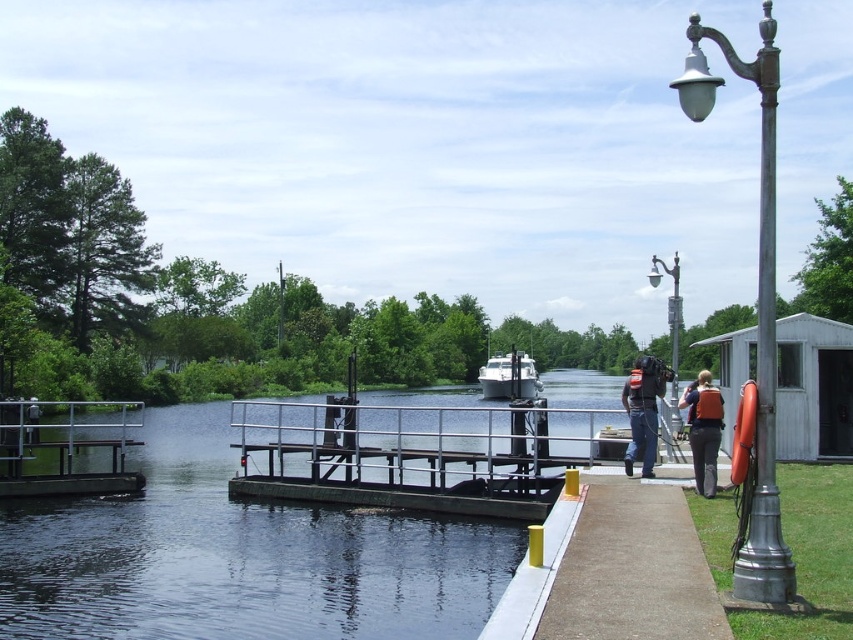
Looking at this image, does bronze metallic lamp post at right have a larger size compared to orange life vest at right?

Yes.

Between point (769, 374) and point (712, 422), which one is positioned in front?

Point (769, 374) is in front.

I want to click on bronze metallic lamp post at right, so click(x=757, y=305).

I want to click on bronze metallic lamp post at right, so click(757, 305).

Can you confirm if orange life vest at right is shorter than metallic gray streetlight at upper right?

Indeed, orange life vest at right has a lesser height compared to metallic gray streetlight at upper right.

Can you confirm if orange life vest at right is positioned above metallic gray streetlight at upper right?

Actually, orange life vest at right is below metallic gray streetlight at upper right.

Is point (692, 435) closer to camera compared to point (672, 300)?

That is True.

Identify the location of orange life vest at right. (703, 429).

Can you confirm if orange life vest at right is positioned above orange fabric life jacket at right?

No.

Between point (705, 420) and point (714, 420), which one is positioned in front?

Point (705, 420) is more forward.

Measure the distance between point (715, 440) and camera.

A distance of 12.35 meters exists between point (715, 440) and camera.

I want to click on orange life vest at right, so click(x=703, y=429).